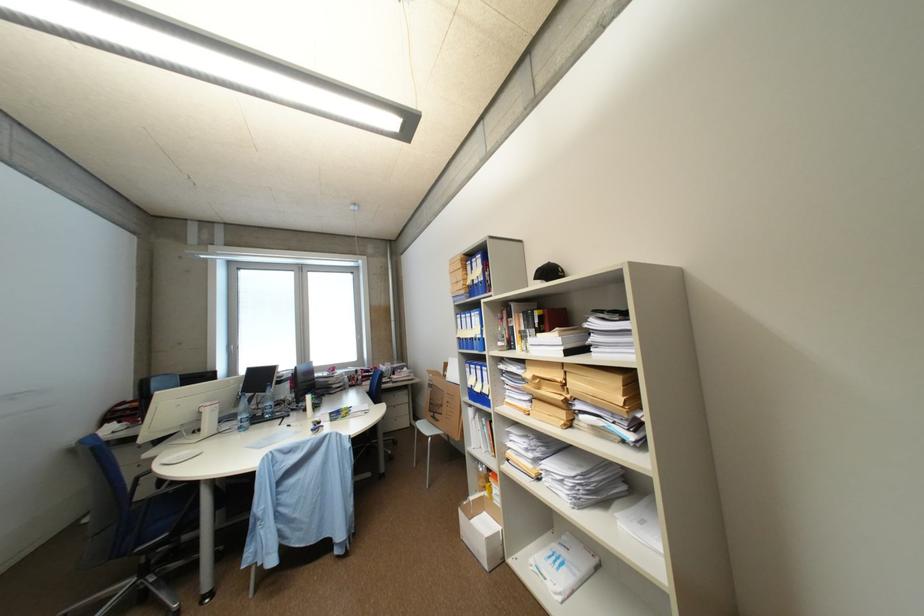
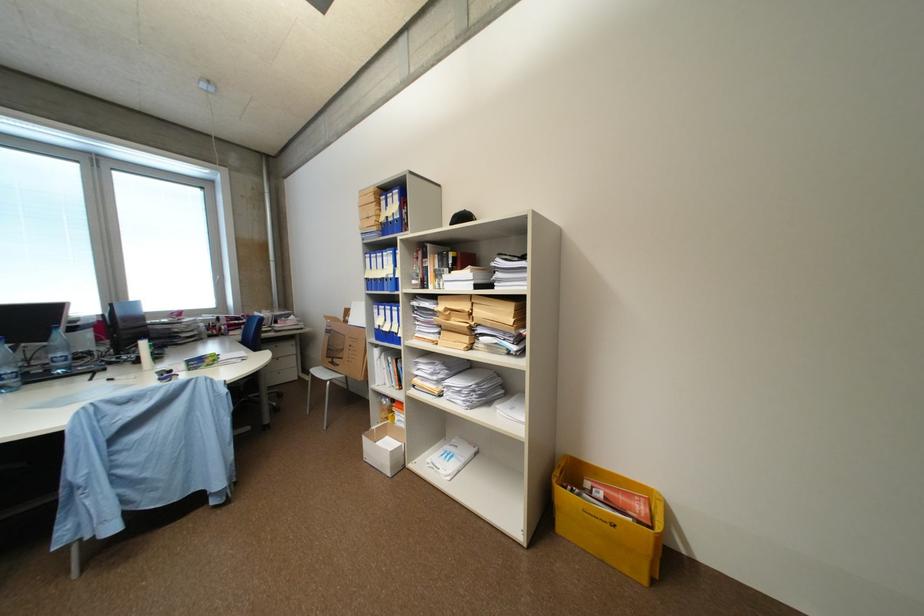
Where in the second image is the point corresponding to [249,429] from the first image?

(10, 389)